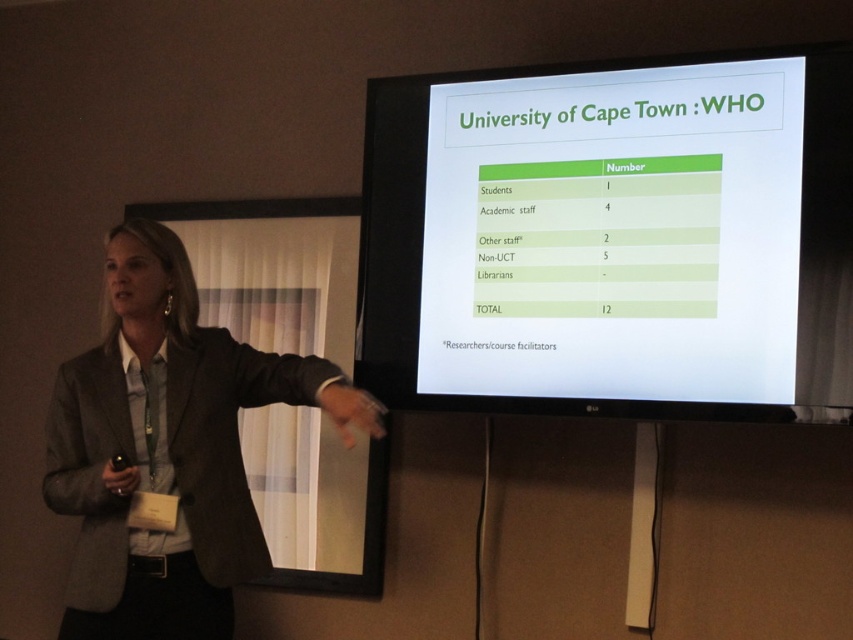
Does green matte projection screen at upper center come in front of gray fabric jacket at left?

No.

The width and height of the screenshot is (853, 640). Describe the element at coordinates (614, 234) in the screenshot. I see `green matte projection screen at upper center` at that location.

The image size is (853, 640). I want to click on green matte projection screen at upper center, so click(x=614, y=234).